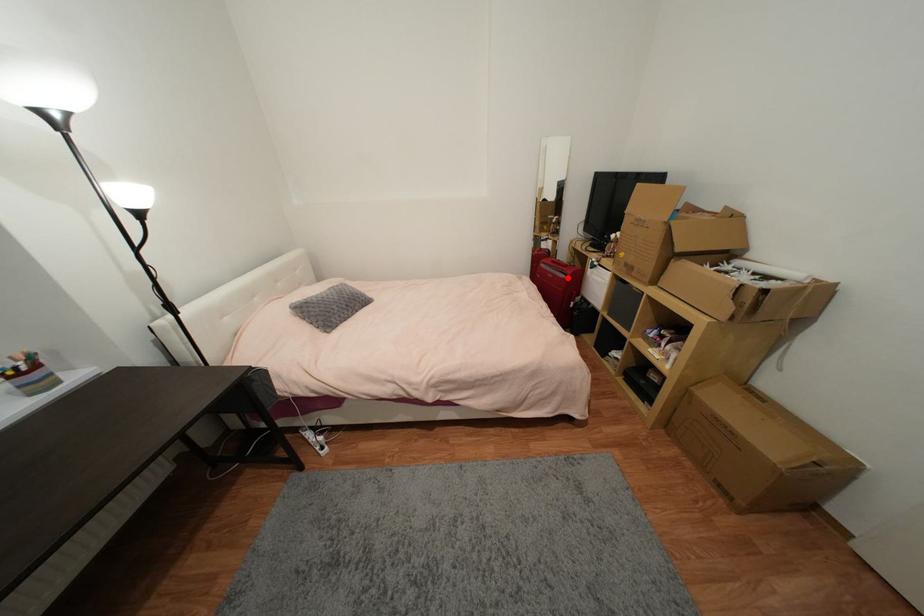
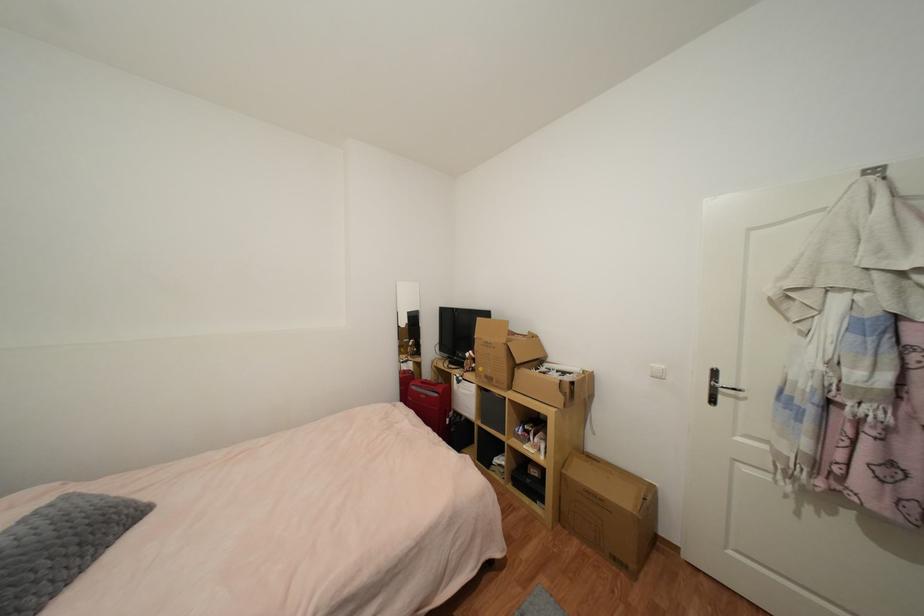
Question: I am providing you with two images of the same scene from different viewpoints. A red point is shown in image1. For the corresponding object point in image2, is it positioned nearer or farther from the camera?

Choices:
 (A) Nearer
 (B) Farther

Answer: (B)